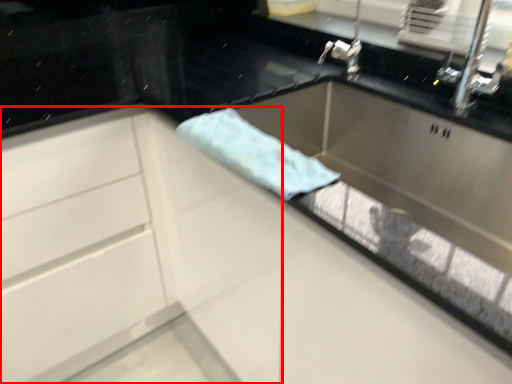
Question: From the image's perspective, what is the correct spatial positioning of cabinetry (annotated by the red box) in reference to beach towel?

Choices:
 (A) below
 (B) above

Answer: (A)